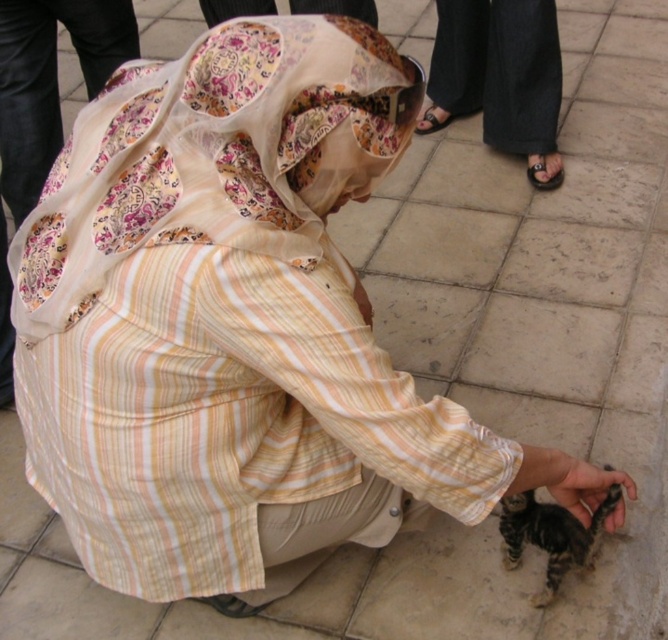
Question: Is striped fur kitten at lower right below soft fur paw at lower right?

Choices:
 (A) no
 (B) yes

Answer: (B)

Question: Which object is the farthest from the black cotton pants at upper center?

Choices:
 (A) floral sheer scarf at center
 (B) black leather sandal at lower right
 (C) soft fur paw at lower right
 (D) striped fur kitten at lower right

Answer: (C)

Question: Which point is farther from the camera taking this photo?

Choices:
 (A) (496, 90)
 (B) (576, 564)
 (C) (542, 180)

Answer: (A)

Question: Which of the following is the closest to the observer?

Choices:
 (A) floral sheer scarf at center
 (B) black leather sandal at lower right
 (C) black cotton pants at upper center
 (D) soft fur paw at lower right

Answer: (A)

Question: In this image, where is floral sheer scarf at center located relative to striped fur kitten at lower right?

Choices:
 (A) below
 (B) above

Answer: (B)

Question: Is black cotton pants at upper center above black leather sandal at lower right?

Choices:
 (A) yes
 (B) no

Answer: (A)